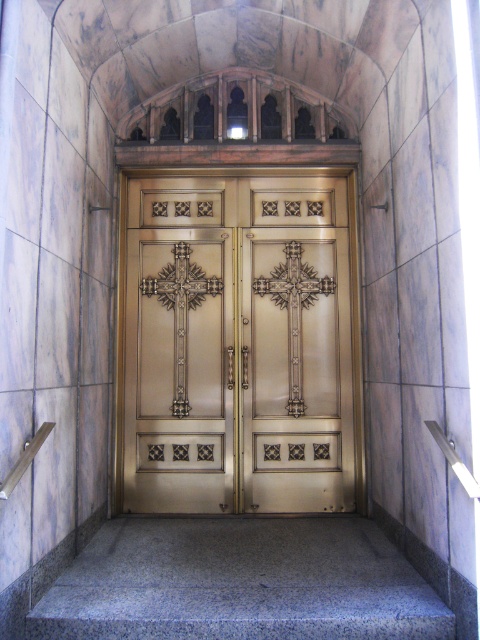
Question: Among these objects, which one is nearest to the camera?

Choices:
 (A) granite at center
 (B) gold polished metal doors at center

Answer: (A)

Question: From the image, what is the correct spatial relationship of gold polished metal doors at center in relation to granite at center?

Choices:
 (A) left
 (B) right

Answer: (B)

Question: Where is gold polished metal doors at center located in relation to granite at center in the image?

Choices:
 (A) right
 (B) left

Answer: (A)

Question: Which point is closer to the camera?

Choices:
 (A) gold polished metal doors at center
 (B) granite at center

Answer: (B)

Question: Considering the relative positions of gold polished metal doors at center and granite at center in the image provided, where is gold polished metal doors at center located with respect to granite at center?

Choices:
 (A) left
 (B) right

Answer: (B)

Question: Which of the following is the closest to the observer?

Choices:
 (A) gold polished metal doors at center
 (B) granite at center

Answer: (B)